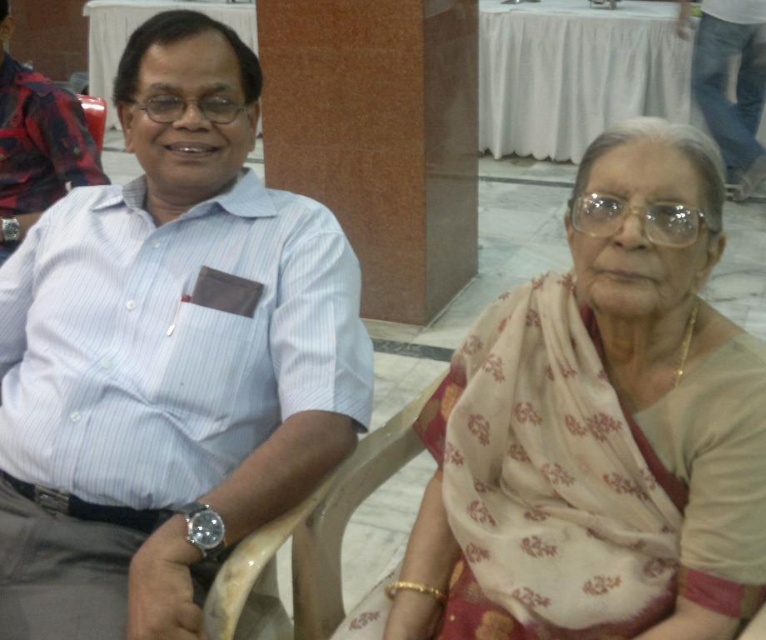
Can you confirm if white striped shirt at left is wider than matte white shirt at left?

Yes, white striped shirt at left is wider than matte white shirt at left.

Who is more forward, (129, 378) or (74, 179)?

Positioned in front is point (129, 378).

At what (x,y) coordinates should I click in order to perform the action: click on white striped shirt at left. Please return your answer as a coordinate pair (x, y). This screenshot has height=640, width=766. Looking at the image, I should click on (169, 356).

Which of these two, wooden at center or matte white shirt at left, stands taller?

With more height is matte white shirt at left.

Is point (393, 426) less distant than point (34, 189)?

Yes, point (393, 426) is in front of point (34, 189).

Which is in front, point (316, 536) or point (35, 74)?

Positioned in front is point (316, 536).

You are a GUI agent. You are given a task and a screenshot of the screen. Output one action in this format:
    pyautogui.click(x=<x>, y=<y>)
    Task: Click on the wooden at center
    
    Given the screenshot: What is the action you would take?
    pyautogui.click(x=313, y=538)

Does point (77, 140) come closer to viewer compared to point (722, 4)?

Yes, it is.

Describe the element at coordinates (38, 144) in the screenshot. I see `matte white shirt at left` at that location.

Is point (71, 93) closer to viewer compared to point (745, 170)?

Yes, point (71, 93) is closer to viewer.

You are a GUI agent. You are given a task and a screenshot of the screen. Output one action in this format:
    pyautogui.click(x=<x>, y=<y>)
    Task: Click on the matte white shirt at left
    The height and width of the screenshot is (640, 766).
    Given the screenshot: What is the action you would take?
    pyautogui.click(x=38, y=144)